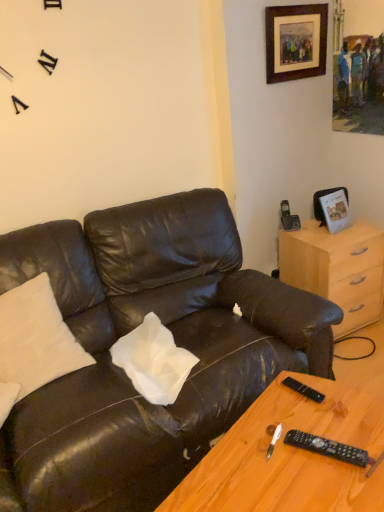
Where is `free space behind black plastic remote at lower right, placed as the first remote when sorted from bottom to top`? free space behind black plastic remote at lower right, placed as the first remote when sorted from bottom to top is located at coordinates (310, 413).